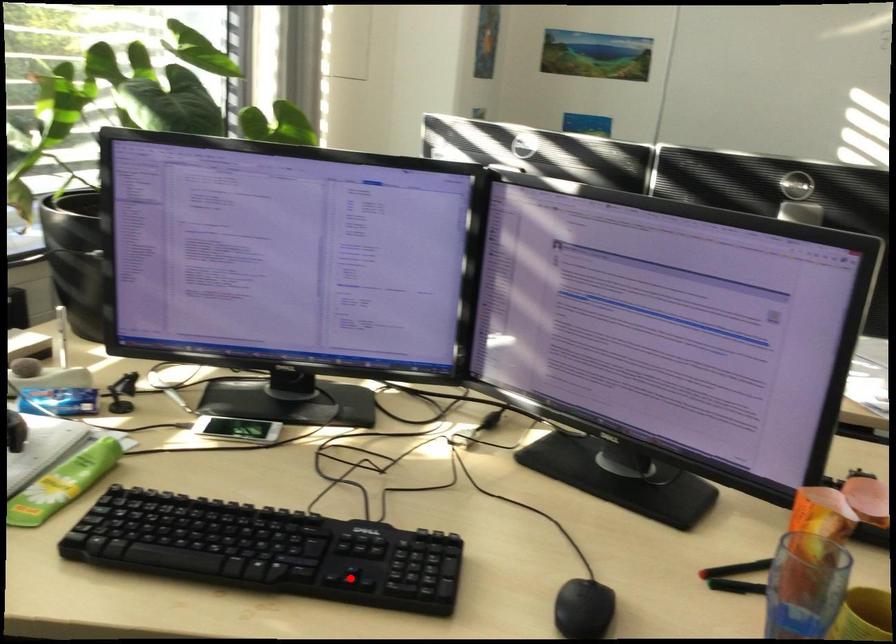
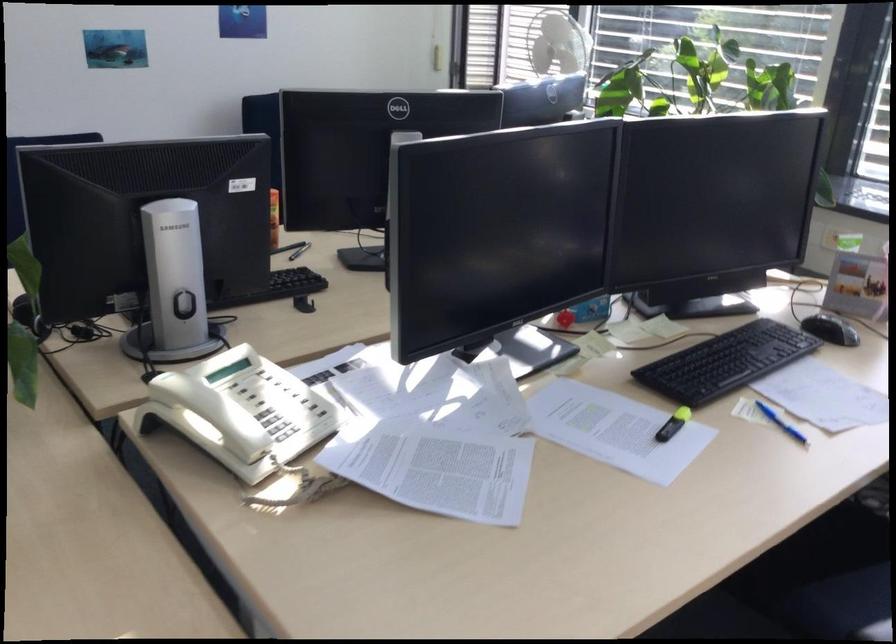
Question: I am providing you with two images of the same scene from different viewpoints. A red point is marked on the first image. Is the red point's position out of view in image 2?

Choices:
 (A) Yes
 (B) No

Answer: (A)